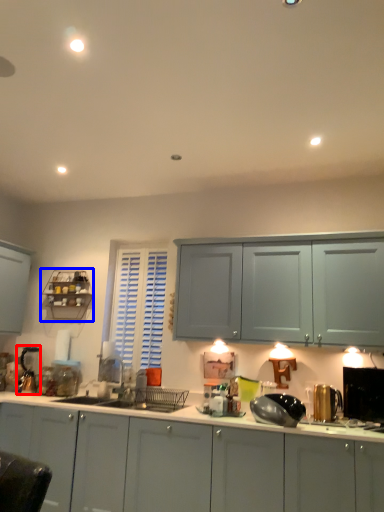
Question: Which object is further to the camera taking this photo, appliance (highlighted by a red box) or shelf (highlighted by a blue box)?

Choices:
 (A) appliance
 (B) shelf

Answer: (B)